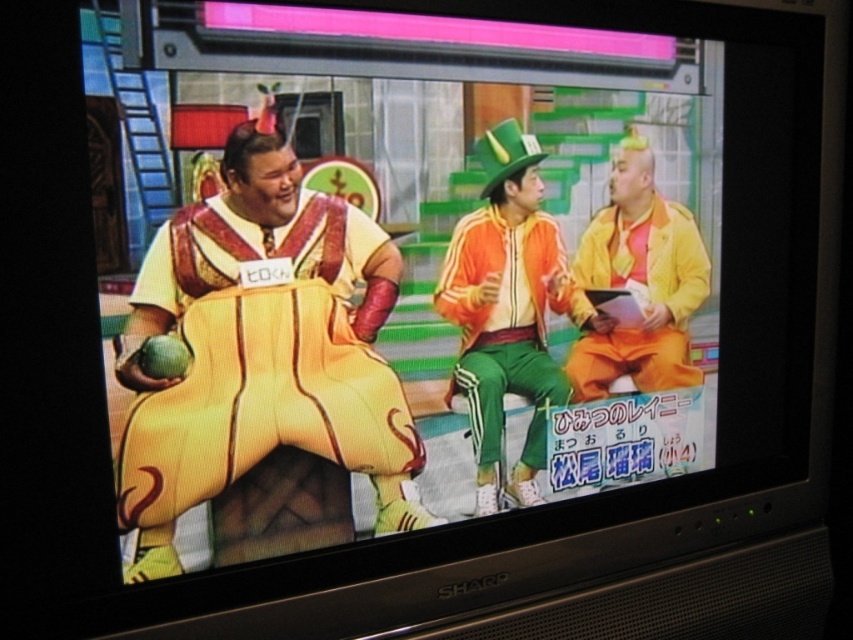
Question: Considering the real-world distances, which object is farthest from the orange velour tracksuit at center?

Choices:
 (A) matte yellow jacket at right
 (B) yellow fabric costume at left

Answer: (B)

Question: Can you confirm if yellow fabric costume at left is positioned to the right of orange velour tracksuit at center?

Choices:
 (A) no
 (B) yes

Answer: (A)

Question: Considering the real-world distances, which object is closest to the orange velour tracksuit at center?

Choices:
 (A) yellow fabric costume at left
 (B) matte yellow jacket at right

Answer: (B)

Question: Can you confirm if yellow fabric costume at left is positioned to the right of matte yellow jacket at right?

Choices:
 (A) no
 (B) yes

Answer: (A)

Question: Among these points, which one is nearest to the camera?

Choices:
 (A) (706, 273)
 (B) (473, 445)

Answer: (B)

Question: Does orange velour tracksuit at center have a smaller size compared to matte yellow jacket at right?

Choices:
 (A) yes
 (B) no

Answer: (A)